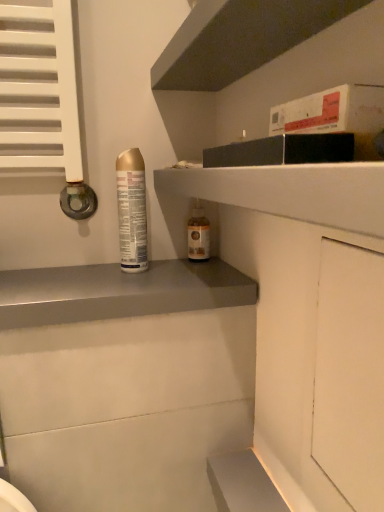
Question: Is smooth gray shelf at center, which ranks as the 3th shelf in top-to-bottom order, inside dark gray matte shelf at upper center, the 1th shelf positioned from the top?

Choices:
 (A) no
 (B) yes

Answer: (A)

Question: Considering the relative positions of dark gray matte shelf at upper center, positioned as the 3th shelf in bottom-to-top order, and smooth gray shelf at center, which ranks as the 3th shelf in top-to-bottom order, in the image provided, is dark gray matte shelf at upper center, positioned as the 3th shelf in bottom-to-top order, to the right of smooth gray shelf at center, which ranks as the 3th shelf in top-to-bottom order, from the viewer's perspective?

Choices:
 (A) no
 (B) yes

Answer: (B)

Question: Is dark gray matte shelf at upper center, positioned as the 3th shelf in bottom-to-top order, not inside smooth gray shelf at center, placed as the first shelf when sorted from bottom to top?

Choices:
 (A) no
 (B) yes

Answer: (B)

Question: From a real-world perspective, is dark gray matte shelf at upper center, the 1th shelf positioned from the top, physically above smooth gray shelf at center, which ranks as the 3th shelf in top-to-bottom order?

Choices:
 (A) yes
 (B) no

Answer: (A)

Question: Is dark gray matte shelf at upper center, the 1th shelf positioned from the top, to the left of smooth gray shelf at center, which ranks as the 3th shelf in top-to-bottom order, from the viewer's perspective?

Choices:
 (A) no
 (B) yes

Answer: (A)

Question: Can you confirm if dark gray matte shelf at upper center, positioned as the 3th shelf in bottom-to-top order, is thinner than smooth gray shelf at center, placed as the first shelf when sorted from bottom to top?

Choices:
 (A) no
 (B) yes

Answer: (B)

Question: Does white matte cabinet at right have a greater width compared to smooth gray shelf at center, which ranks as the 3th shelf in top-to-bottom order?

Choices:
 (A) yes
 (B) no

Answer: (B)

Question: Considering the relative sizes of white matte cabinet at right and smooth gray shelf at center, which ranks as the 3th shelf in top-to-bottom order, in the image provided, is white matte cabinet at right smaller than smooth gray shelf at center, which ranks as the 3th shelf in top-to-bottom order,?

Choices:
 (A) no
 (B) yes

Answer: (B)

Question: Can smooth gray shelf at center, which ranks as the 3th shelf in top-to-bottom order, be found inside white matte cabinet at right?

Choices:
 (A) no
 (B) yes

Answer: (A)

Question: Does white matte cabinet at right have a lesser width compared to smooth gray shelf at center, placed as the first shelf when sorted from bottom to top?

Choices:
 (A) yes
 (B) no

Answer: (A)

Question: From the image's perspective, is white matte cabinet at right located beneath smooth gray shelf at center, which ranks as the 3th shelf in top-to-bottom order?

Choices:
 (A) yes
 (B) no

Answer: (A)

Question: Considering the relative positions of white matte cabinet at right and smooth gray shelf at center, placed as the first shelf when sorted from bottom to top, in the image provided, is white matte cabinet at right to the left of smooth gray shelf at center, placed as the first shelf when sorted from bottom to top, from the viewer's perspective?

Choices:
 (A) yes
 (B) no

Answer: (B)

Question: Considering the relative positions of white matte cabinet at right and gold metallic can at left, which is the second bottle in back-to-front order, in the image provided, is white matte cabinet at right in front of gold metallic can at left, which is the second bottle in back-to-front order,?

Choices:
 (A) no
 (B) yes

Answer: (B)